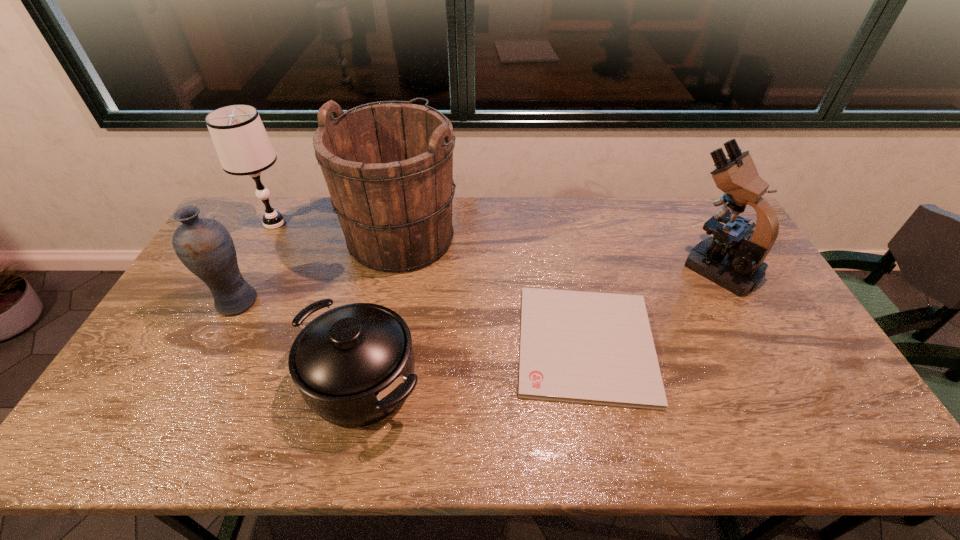
Where is `free space located 0.150m on the right of the fourth tallest object`? The width and height of the screenshot is (960, 540). free space located 0.150m on the right of the fourth tallest object is located at coordinates (308, 302).

Identify the location of vacant point located on the left of the fifth tallest object. The image size is (960, 540). click(217, 382).

You are a GUI agent. You are given a task and a screenshot of the screen. Output one action in this format:
    pyautogui.click(x=<x>, y=<y>)
    Task: Click on the free location located 0.130m on the back of the shortest object
    The image size is (960, 540).
    Given the screenshot: What is the action you would take?
    pyautogui.click(x=569, y=262)

This screenshot has width=960, height=540. I want to click on bucket present at the far edge, so click(x=388, y=165).

Where is `table lamp situated at the far edge`? The height and width of the screenshot is (540, 960). table lamp situated at the far edge is located at coordinates click(242, 144).

The image size is (960, 540). Find the location of `object situated at the near edge`. object situated at the near edge is located at coordinates (354, 365).

What are the coordinates of `table lamp at the left edge` in the screenshot? It's located at (242, 144).

I want to click on vase situated at the left edge, so click(x=204, y=245).

In order to click on object present at the right edge in this screenshot , I will do `click(733, 258)`.

Where is `object located at the far left corner`? object located at the far left corner is located at coordinates (242, 144).